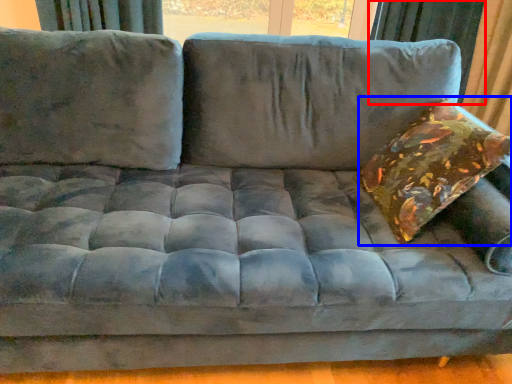
Question: Which object appears farthest to the camera in this image, curtain (highlighted by a red box) or throw pillow (highlighted by a blue box)?

Choices:
 (A) curtain
 (B) throw pillow

Answer: (A)